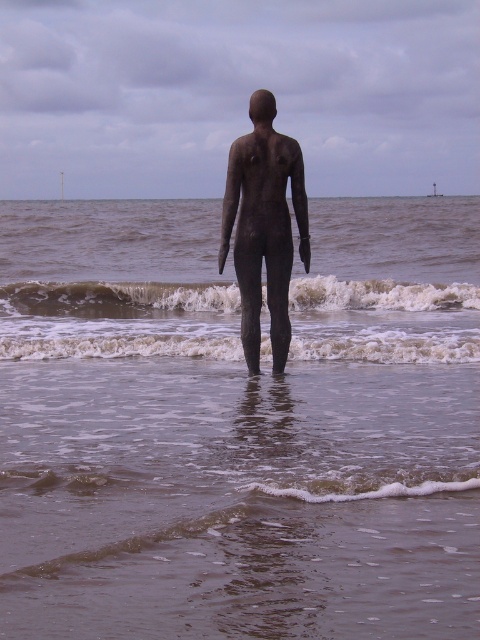
Question: Which is farther from the white foamy wave at center?

Choices:
 (A) white frothy wave at center
 (B) matte bronze figure at center
 (C) brown textured water at center

Answer: (C)

Question: Which object is farther from the camera taking this photo?

Choices:
 (A) white foamy wave at center
 (B) matte bronze figure at center
 (C) white frothy wave at center

Answer: (C)

Question: From the image, what is the correct spatial relationship of white frothy wave at center in relation to white foamy wave at center?

Choices:
 (A) left
 (B) right

Answer: (A)

Question: Among these objects, which one is farthest from the camera?

Choices:
 (A) white frothy wave at center
 (B) brown textured water at center
 (C) matte bronze figure at center
 (D) white foamy wave at center

Answer: (A)

Question: Considering the relative positions of matte bronze figure at center and white foamy wave at center in the image provided, where is matte bronze figure at center located with respect to white foamy wave at center?

Choices:
 (A) right
 (B) left

Answer: (B)

Question: Is white frothy wave at center thinner than white foamy wave at center?

Choices:
 (A) yes
 (B) no

Answer: (A)